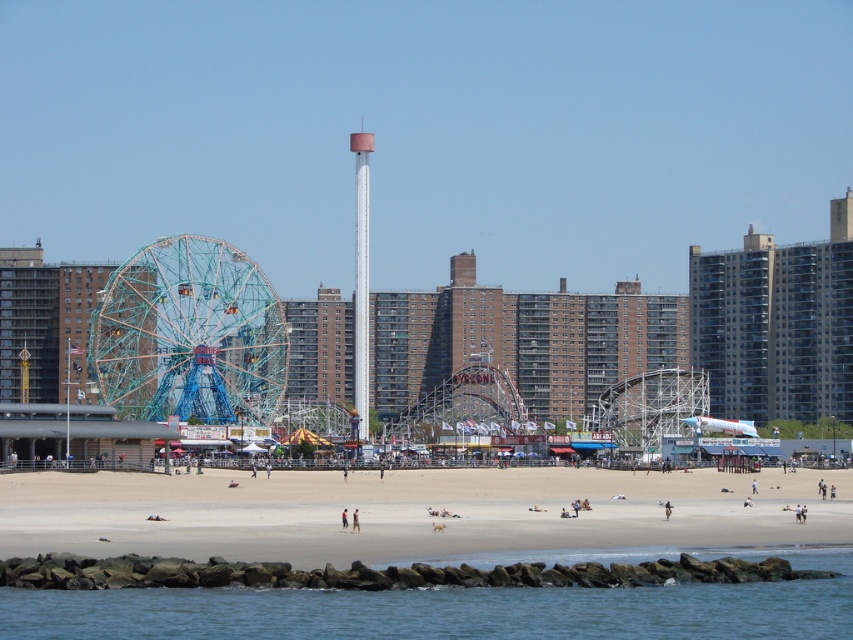
Question: Is beige sand beach at center to the left of teal metallic ferris wheel at center-left from the viewer's perspective?

Choices:
 (A) no
 (B) yes

Answer: (A)

Question: Which point is closer to the camera taking this photo?

Choices:
 (A) (48, 513)
 (B) (274, 304)
 (C) (503, 604)
 (D) (361, 433)

Answer: (C)

Question: Which point is closer to the camera?

Choices:
 (A) blue water at lower center
 (B) white smooth tower at center
 (C) teal metallic ferris wheel at center-left

Answer: (A)

Question: Based on their relative distances, which object is farther from the beige sand beach at center?

Choices:
 (A) white smooth tower at center
 (B) teal metallic ferris wheel at center-left

Answer: (A)

Question: Does blue water at lower center have a larger size compared to white smooth tower at center?

Choices:
 (A) no
 (B) yes

Answer: (A)

Question: Can you confirm if blue water at lower center is wider than white smooth tower at center?

Choices:
 (A) no
 (B) yes

Answer: (B)